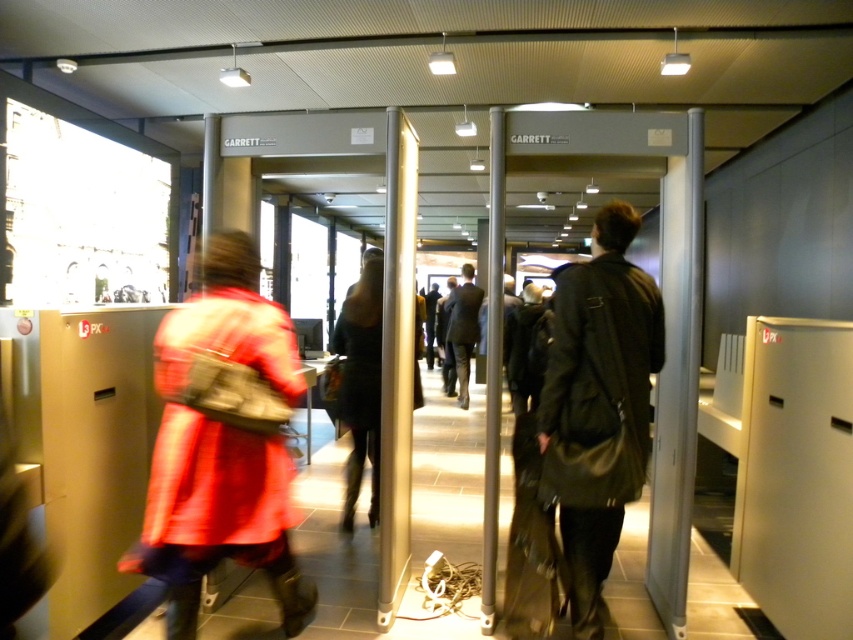
Question: Which point is closer to the camera?

Choices:
 (A) dark green leather jacket at center
 (B) dark gray suit at center
 (C) matte red coat at center

Answer: (C)

Question: From the image, what is the correct spatial relationship of dark green leather jacket at center in relation to dark gray suit at center?

Choices:
 (A) right
 (B) left

Answer: (A)

Question: Does dark green leather jacket at center appear over dark gray suit at center?

Choices:
 (A) no
 (B) yes

Answer: (A)

Question: Which object appears farthest from the camera in this image?

Choices:
 (A) matte red coat at center
 (B) dark gray suit at center
 (C) dark green leather jacket at center

Answer: (B)

Question: Which point is farther to the camera?

Choices:
 (A) dark gray suit at center
 (B) dark green leather jacket at center

Answer: (A)

Question: Does matte red coat at center lie in front of dark green leather jacket at center?

Choices:
 (A) yes
 (B) no

Answer: (A)